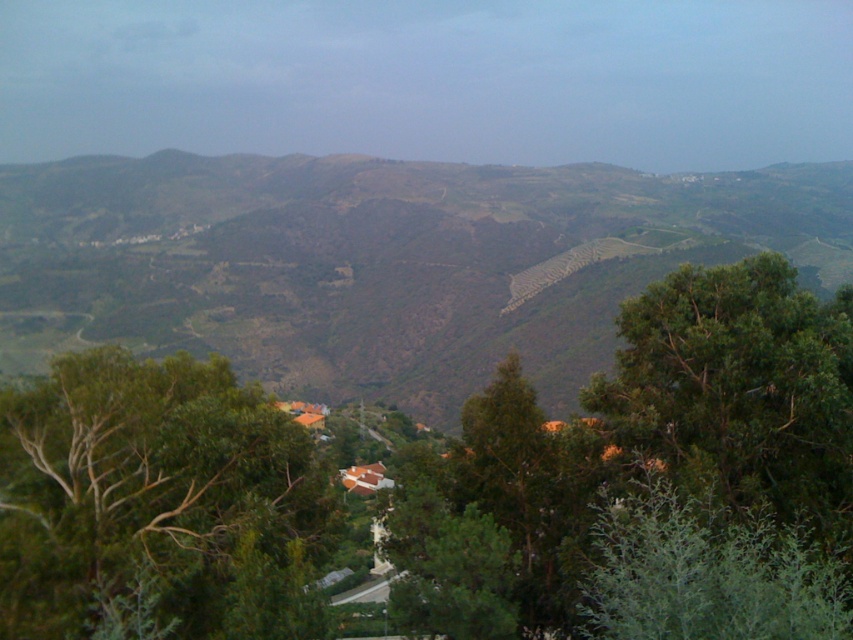
Question: Is green grassy hillside at center further to camera compared to green leafy tree at center-right?

Choices:
 (A) no
 (B) yes

Answer: (B)

Question: Does green grassy hillside at center have a lesser width compared to green leafy tree at center-right?

Choices:
 (A) yes
 (B) no

Answer: (B)

Question: Among these objects, which one is farthest from the camera?

Choices:
 (A) green grassy hillside at center
 (B) green leafy tree at lower left

Answer: (A)

Question: Which point is closer to the camera taking this photo?

Choices:
 (A) (674, 276)
 (B) (577, 209)
 (C) (270, 531)

Answer: (C)

Question: Which point is farther from the camera taking this photo?

Choices:
 (A) (519, 342)
 (B) (22, 636)
 (C) (734, 404)

Answer: (A)

Question: Can you confirm if green leafy tree at lower left is positioned above green leafy tree at center-right?

Choices:
 (A) yes
 (B) no

Answer: (B)